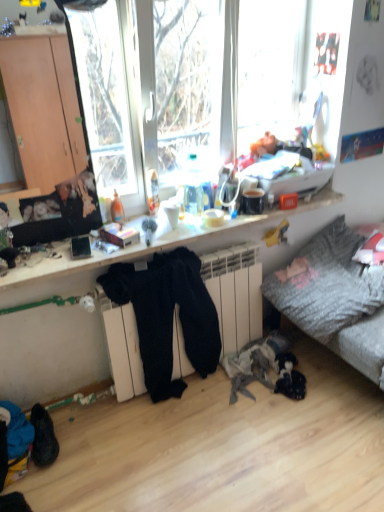
Image resolution: width=384 pixels, height=512 pixels. Identify the location of vacant location below black suede shoes at lower left (from a real-world perspective). (56, 444).